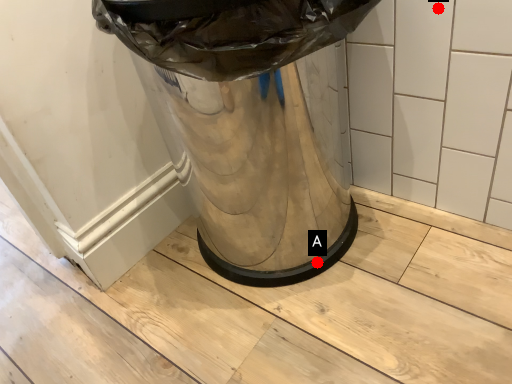
Question: Two points are circled on the image, labeled by A and B beside each circle. Which point appears farthest from the camera in this image?

Choices:
 (A) A is further
 (B) B is further

Answer: (A)